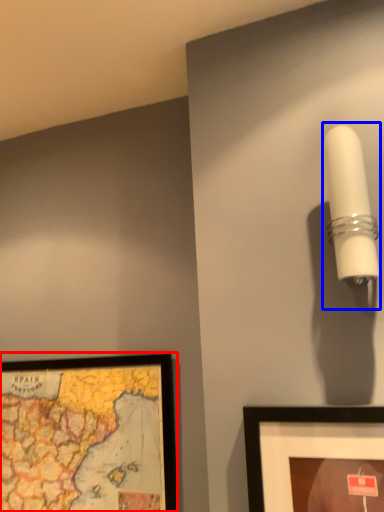
Question: Which object appears farthest to the camera in this image, picture frame (highlighted by a red box) or lamp (highlighted by a blue box)?

Choices:
 (A) picture frame
 (B) lamp

Answer: (A)